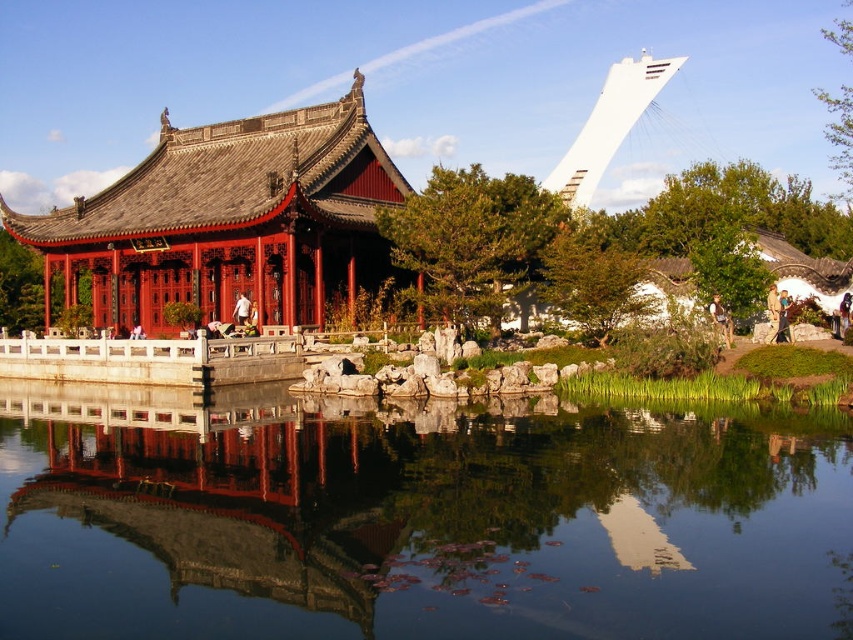
You are an architect designing a new garden layout. You need to place a small statue between the transparent glass water at center and the matte red wood palace at left. Based on their sizes, where should the statue be placed to ensure it doesn

The transparent glass water at center occupies less space than the matte red wood palace at left, so the statue should be placed closer to the transparent glass water at center to balance the layout.

You are a visitor standing in the garden and want to take a photo of the matte red wood palace at left without any obstructions. Is the transparent glass water at center blocking your view of the palace?

The transparent glass water at center is in front of the matte red wood palace at left, so it might obstruct the view depending on the angle and clarity of the water. However, since the water is described as transparent glass, it may allow a clear view through it to the palace behind.